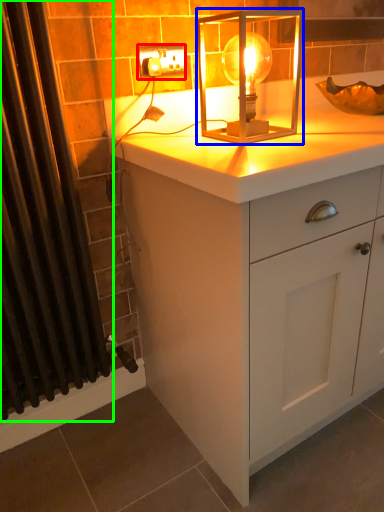
Question: Considering the real-world distances, which object is farthest from electric outlet (highlighted by a red box)? lamp (highlighted by a blue box) or shower curtain (highlighted by a green box)?

Choices:
 (A) lamp
 (B) shower curtain

Answer: (B)